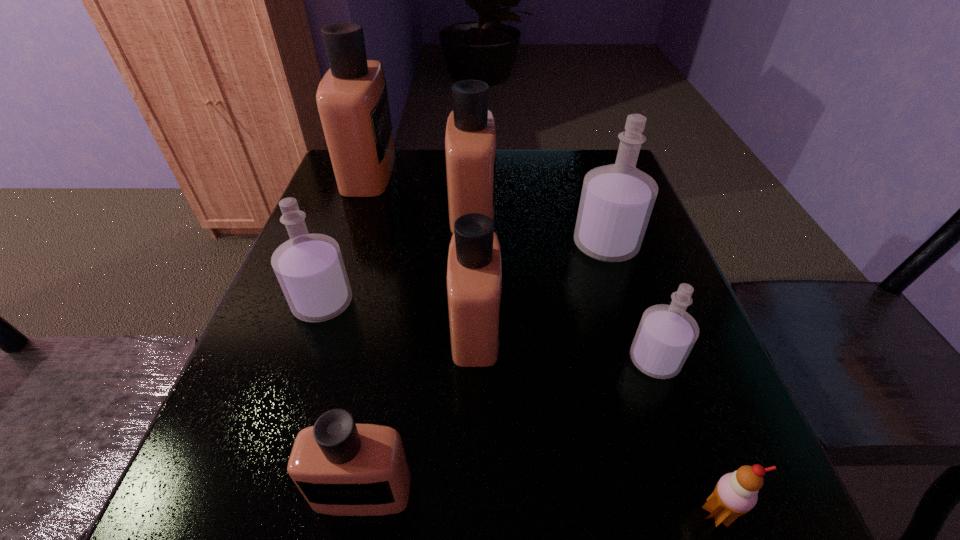
Identify the location of object that is at the far left corner. This screenshot has width=960, height=540. (352, 99).

At what (x,y) coordinates should I click in order to perform the action: click on object at the near right corner. Please return your answer as a coordinate pair (x, y). Looking at the image, I should click on (735, 494).

Identify the location of vacant position at the far edge of the desktop. pos(419,166).

You are a GUI agent. You are given a task and a screenshot of the screen. Output one action in this format:
    pyautogui.click(x=<x>, y=<y>)
    Task: Click on the free space at the near edge
    The height and width of the screenshot is (540, 960).
    Given the screenshot: What is the action you would take?
    pyautogui.click(x=619, y=500)

You are a GUI agent. You are given a task and a screenshot of the screen. Output one action in this format:
    pyautogui.click(x=<x>, y=<y>)
    Task: Click on the vacant space at the left edge of the desktop
    The image size is (960, 540).
    Given the screenshot: What is the action you would take?
    pyautogui.click(x=339, y=357)

Where is `vacant space at the right edge`? This screenshot has height=540, width=960. vacant space at the right edge is located at coordinates (660, 443).

This screenshot has height=540, width=960. I want to click on free space between the smallest purple perfume and the second biggest beige perfume, so click(564, 285).

This screenshot has height=540, width=960. I want to click on free area in between the smallest purple perfume and the biggest purple perfume, so click(x=630, y=302).

Where is `blank region between the second biggest beige perfume and the leftmost purple perfume`? blank region between the second biggest beige perfume and the leftmost purple perfume is located at coordinates [397, 256].

I want to click on vacant space that is in between the shortest object and the tallest perfume, so click(543, 342).